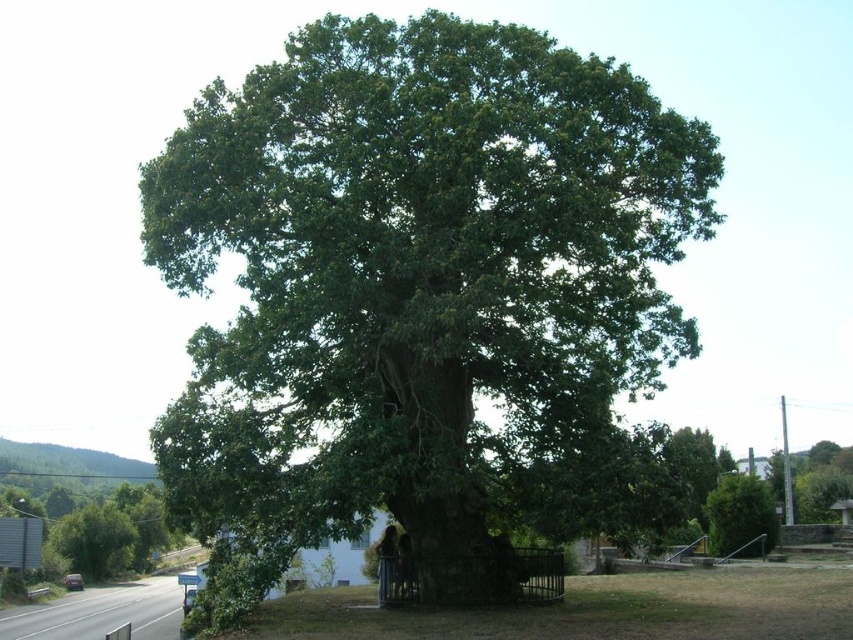
How far apart are green leafy oak tree at center and green leafy tree at center?

green leafy oak tree at center is 63.38 feet from green leafy tree at center.

Does green leafy oak tree at center appear over green leafy tree at center?

Indeed, green leafy oak tree at center is positioned over green leafy tree at center.

Where is `green leafy oak tree at center`? This screenshot has width=853, height=640. green leafy oak tree at center is located at coordinates (424, 298).